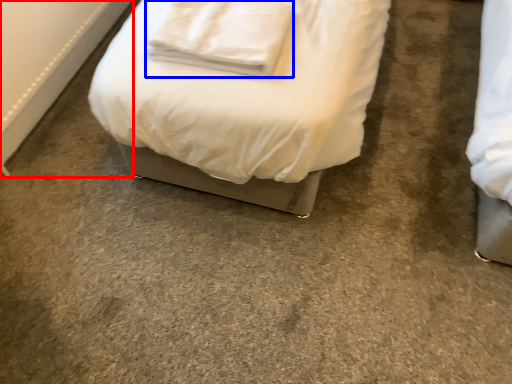
Question: Which object appears farthest to the camera in this image, radiator (highlighted by a red box) or pillow (highlighted by a blue box)?

Choices:
 (A) radiator
 (B) pillow

Answer: (A)